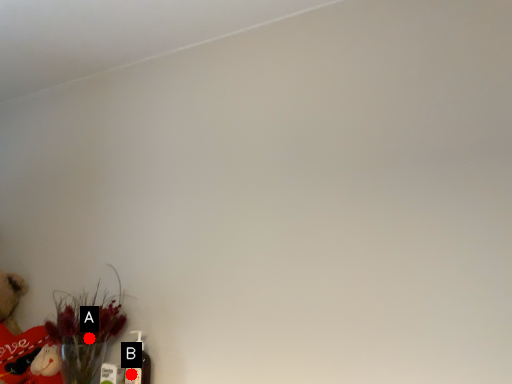
Question: Two points are circled on the image, labeled by A and B beside each circle. Which point is farther to the camera?

Choices:
 (A) A is further
 (B) B is further

Answer: (A)